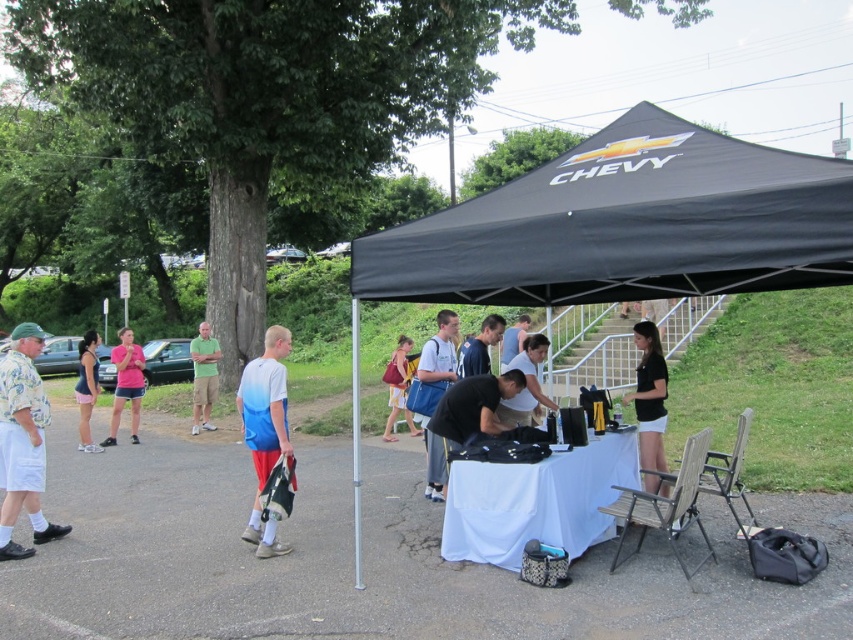
Question: Which object is closer to the camera taking this photo?

Choices:
 (A) black matte shirt at center
 (B) black fabric canopy at center
 (C) matte pink shorts at lower left
 (D) blue fabric shirt at center

Answer: (A)

Question: Which of these objects is positioned closest to the blue gradient t-shirt at center?

Choices:
 (A) black fabric tent at center
 (B) black matte shirt at center
 (C) matte pink shirt at center

Answer: (B)

Question: Is black matte shirt at center positioned in front of matte black shirt at center?

Choices:
 (A) yes
 (B) no

Answer: (A)

Question: Can you confirm if black fabric tent at center is positioned to the right of black matte shirt at center?

Choices:
 (A) yes
 (B) no

Answer: (B)

Question: Is black fabric tent at center positioned behind matte black shirt at center?

Choices:
 (A) yes
 (B) no

Answer: (B)

Question: Which object is farther from the camera taking this photo?

Choices:
 (A) blue fabric shirt at center
 (B) green cotton shirt at center
 (C) matte black shirt at center

Answer: (B)